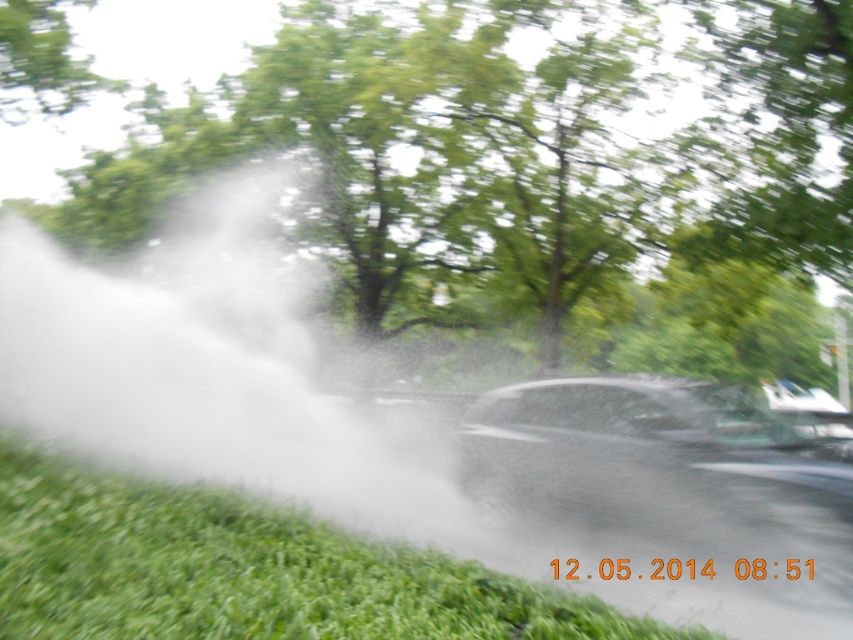
Between point (235, 237) and point (477, 416), which one is positioned in front?

Point (477, 416)

Which is behind, point (135, 445) or point (693, 518)?

The point (135, 445) is more distant.

Identify the location of white mist at center. (215, 372).

Can you confirm if white mist at center is positioned to the right of green grass at lower left?

Incorrect, white mist at center is not on the right side of green grass at lower left.

Is white mist at center above green grass at lower left?

Indeed, white mist at center is positioned over green grass at lower left.

Who is more distant from viewer, (227, 193) or (225, 609)?

The point (227, 193) is more distant.

At what (x,y) coordinates should I click in order to perform the action: click on white mist at center. Please return your answer as a coordinate pair (x, y). Image resolution: width=853 pixels, height=640 pixels. Looking at the image, I should click on (215, 372).

Between green grass at lower left and shiny black car at center, which one appears on the right side from the viewer's perspective?

Positioned to the right is shiny black car at center.

Identify the location of green grass at lower left. (245, 570).

Identify the location of green grass at lower left. (245, 570).